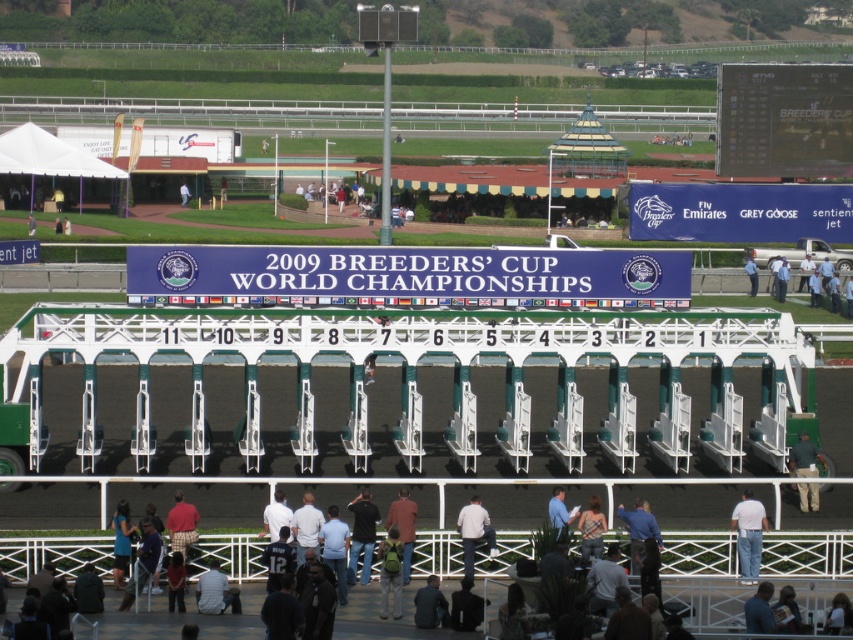
Question: Considering the real-world distances, which object is farthest from the green backpack at center?

Choices:
 (A) blue fabric banner at center
 (B) white cotton shirt at lower center
 (C) dark gray jacket at lower center

Answer: (A)

Question: Is white cotton shirt at lower right below dark blue shirt at lower center?

Choices:
 (A) yes
 (B) no

Answer: (B)

Question: Is blue fabric banner at center to the left of red plaid pants at lower center from the viewer's perspective?

Choices:
 (A) yes
 (B) no

Answer: (B)

Question: Observing the image, what is the correct spatial positioning of white fabric canopy at upper left in reference to green backpack at center?

Choices:
 (A) below
 (B) above

Answer: (B)

Question: Based on their relative distances, which object is nearer to the green fabric jacket at lower right?

Choices:
 (A) light blue shirt at center
 (B) dark gray jacket at lower center
 (C) camouflage fabric shirt at lower center
 (D) dark blue jeans at center

Answer: (C)

Question: Which object appears closest to the camera in this image?

Choices:
 (A) dark blue jeans at center
 (B) dark blue shirt at lower center
 (C) white fabric canopy at upper left

Answer: (B)